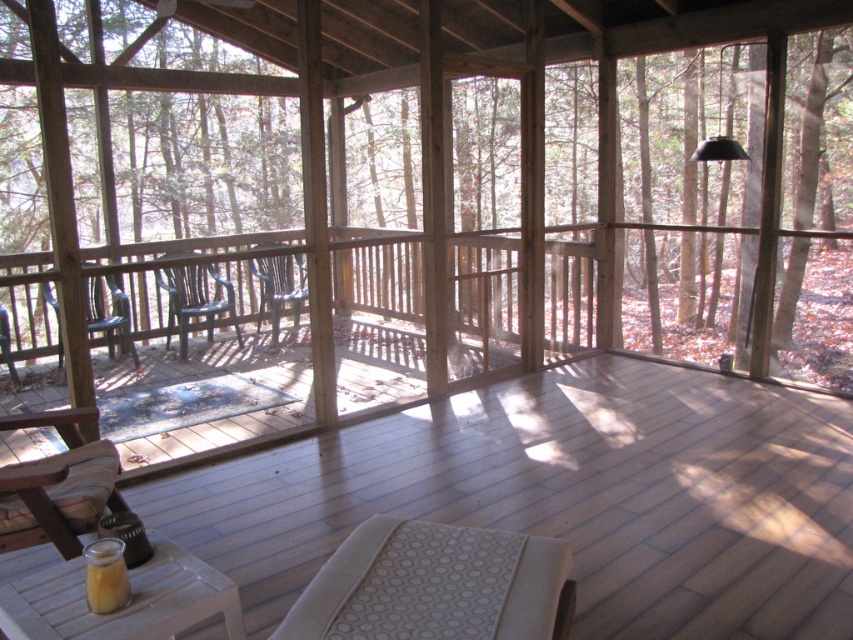
Can you confirm if translucent glass cup at lower left is bigger than wooden chair at center?

No.

Who is higher up, translucent glass cup at lower left or wooden chair at center?

wooden chair at center

Find the location of a particular element. The height and width of the screenshot is (640, 853). translucent glass cup at lower left is located at coordinates pos(107,586).

Is metallic blue chair at center smaller than wooden chair at center?

No, metallic blue chair at center is not smaller than wooden chair at center.

The image size is (853, 640). What do you see at coordinates (195, 300) in the screenshot?
I see `metallic blue chair at center` at bounding box center [195, 300].

Find the location of a particular element. metallic blue chair at center is located at coordinates (195, 300).

Does point (711, 504) lie in front of point (115, 301)?

Yes, point (711, 504) is in front of point (115, 301).

Is wooden deck at center to the right of matte plastic chair at left from the viewer's perspective?

Yes, wooden deck at center is to the right of matte plastic chair at left.

Is point (660, 385) closer to camera compared to point (137, 365)?

Yes, it is in front of point (137, 365).

Where is `wooden deck at center`? The height and width of the screenshot is (640, 853). wooden deck at center is located at coordinates (567, 497).